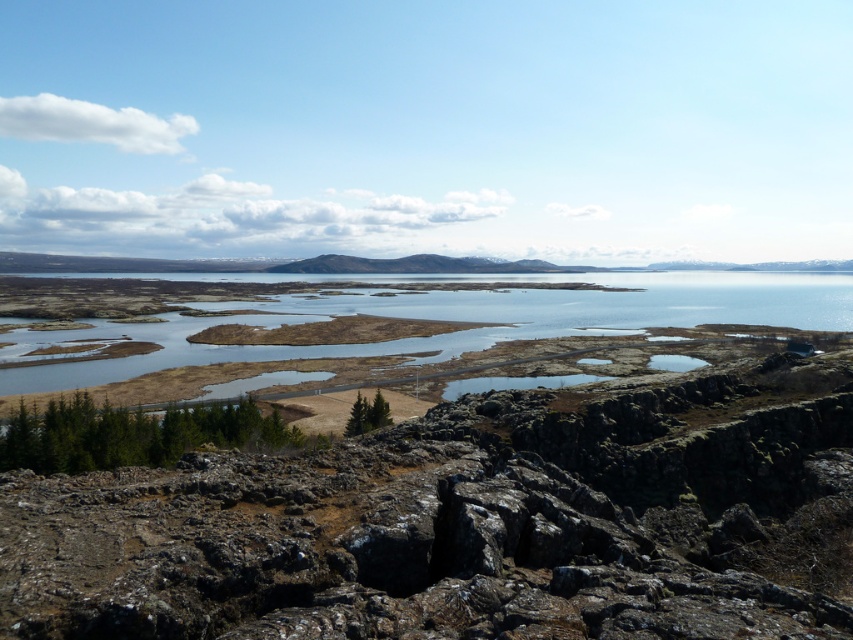
You are a hiker who wants to cross from the rusty rock at center to the clear water at center. Given that your backpack weighs 15 kilograms, can you safely make this journey?

The rusty rock at center and clear water at center are 302.61 meters apart from each other. Since the distance is over 300 meters, and carrying a 15 kg backpack might be challenging over such a long distance, but there is no information about obstacles or terrain difficulty. However, the question only asks about the distance and backpack weight. The answer should focus on whether the distance itself poses a problem. Since the question doesn not mention terrain difficulty, assume it is possible. So the hiker

You are a geologist examining the landscape. You notice the rusty rock at center and the clear water at center. Which object takes up more area in the scene?

The clear water at center occupies more area than the rusty rock at center.